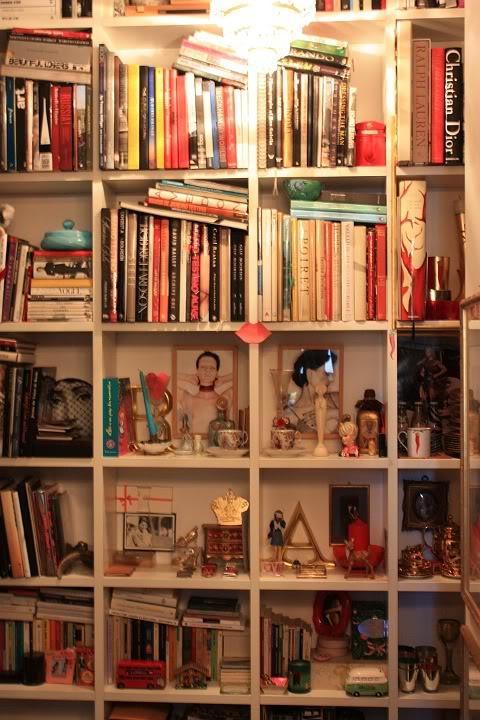
Image resolution: width=480 pixels, height=720 pixels. In order to click on framed pictures in this screenshot , I will do `click(179, 366)`, `click(291, 361)`, `click(132, 525)`, `click(337, 510)`, `click(425, 500)`, `click(336, 620)`.